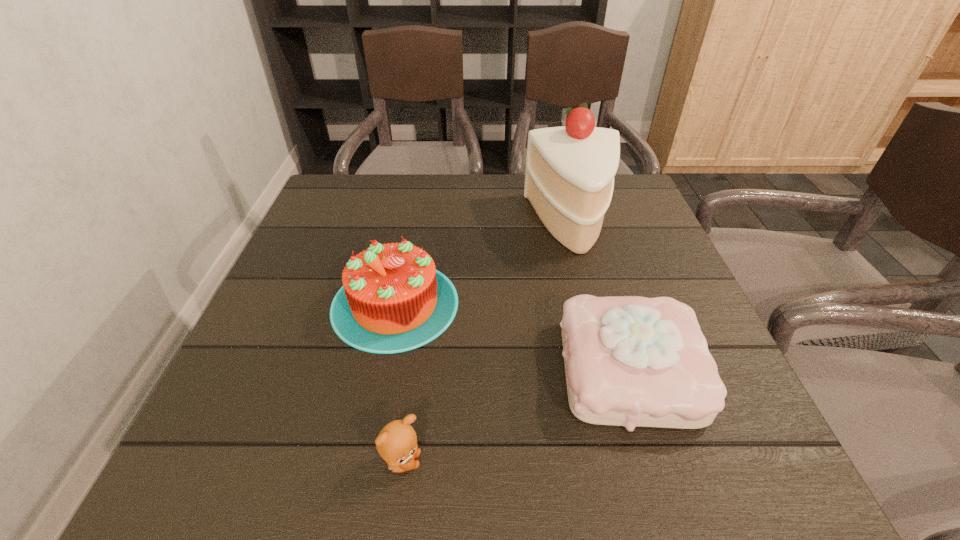
Locate an element on the screen. free space at the far right corner of the desktop is located at coordinates (621, 197).

In order to click on vacant space at the near right corner in this screenshot , I will do `click(739, 441)`.

At what (x,y) coordinates should I click in order to perform the action: click on empty space that is in between the teddy bear and the farthest cake. Please return your answer as a coordinate pair (x, y). The width and height of the screenshot is (960, 540). Looking at the image, I should click on point(487,342).

I want to click on vacant point located between the shortest cake and the teddy bear, so click(x=516, y=416).

The width and height of the screenshot is (960, 540). Identify the location of vacant space that's between the shortest cake and the farthest object. (601, 296).

Where is `vacant area that lies between the nearest object and the farthest object`? vacant area that lies between the nearest object and the farthest object is located at coordinates pyautogui.click(x=487, y=342).

Locate an element on the screen. empty space between the leftmost cake and the nearest object is located at coordinates (398, 383).

At what (x,y) coordinates should I click in order to perform the action: click on free space between the teddy bear and the shortest cake. Please return your answer as a coordinate pair (x, y). The width and height of the screenshot is (960, 540). Looking at the image, I should click on (516, 416).

Where is `vacant region between the nearest object and the farthest object`? The height and width of the screenshot is (540, 960). vacant region between the nearest object and the farthest object is located at coordinates (487, 342).

Find the location of a particular element. The width and height of the screenshot is (960, 540). vacant space that's between the second tallest object and the shortest cake is located at coordinates (513, 337).